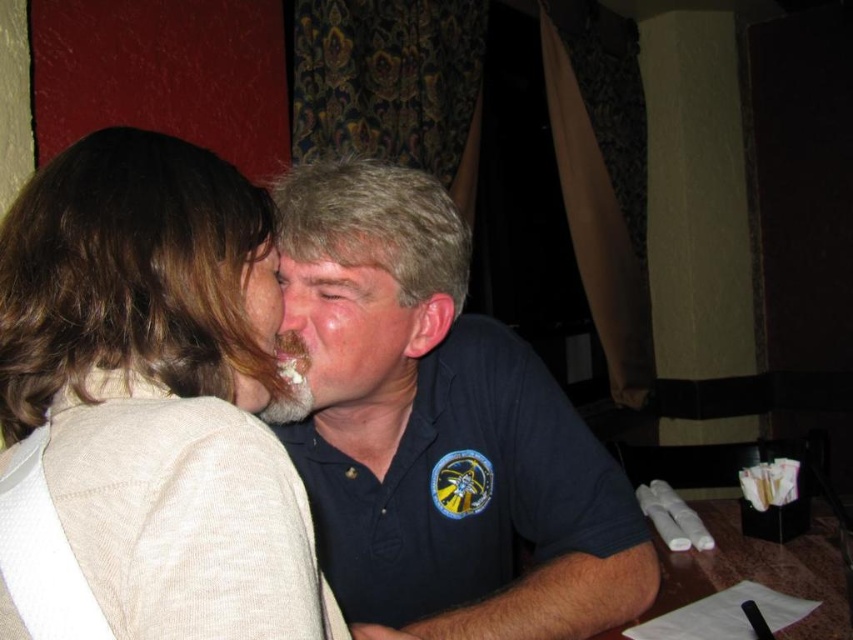
You are a photographer trying to capture a candid shot of the light beige sweater at upper left and the smooth skin forehead at center. To ensure both subjects are in focus, you need to know their relative positions. Which object is located to the left of the other?

The light beige sweater at upper left is positioned on the left side of smooth skin forehead at center.

You are a photographer trying to capture a candid shot of two people at a table. The subjects are the dark blue polo shirt at center and the beige matte face at center. If your camera has a depth of field that can focus clearly on objects within 4 inches, will both subjects be in focus?

The dark blue polo shirt at center is 4.33 inches away from the beige matte face at center. Since the distance between them exceeds the 4 inch depth of field range, not both subjects will be in focus simultaneously.

You are a photographer trying to capture a candid shot of the dark blue polo shirt at center and the beige matte face at center. Since you want to focus on the polo shirt, which object should you position closer to the camera?

The dark blue polo shirt at center is in front of the beige matte face at center, so you should position the dark blue polo shirt at center closer to the camera to focus on it.